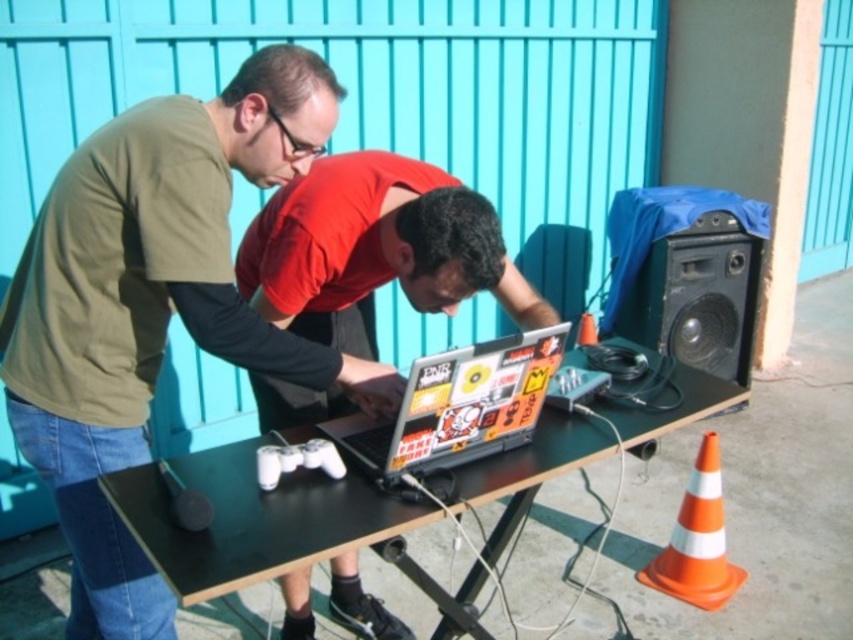
At what (x,y) coordinates should I click in order to perform the action: click on matte black laptop at center. Please return your answer as a coordinate pair (x, y). Image resolution: width=853 pixels, height=640 pixels. Looking at the image, I should click on (154, 305).

The width and height of the screenshot is (853, 640). Describe the element at coordinates (154, 305) in the screenshot. I see `matte black laptop at center` at that location.

Identify the location of matte black laptop at center. (154, 305).

Find the location of `shiny red shirt at center`. shiny red shirt at center is located at coordinates (375, 250).

Is point (477, 275) positioned behind point (247, 477)?

Yes, point (477, 275) is farther from viewer.

This screenshot has height=640, width=853. I want to click on shiny red shirt at center, so click(375, 250).

Can you confirm if matte black laptop at center is bigger than black plastic table at center?

No.

Can you confirm if matte black laptop at center is smaller than black plastic table at center?

Yes, matte black laptop at center is smaller than black plastic table at center.

Is point (154, 636) positioned after point (352, 476)?

Yes, it is.

Where is `matte black laptop at center`? The height and width of the screenshot is (640, 853). matte black laptop at center is located at coordinates (154, 305).